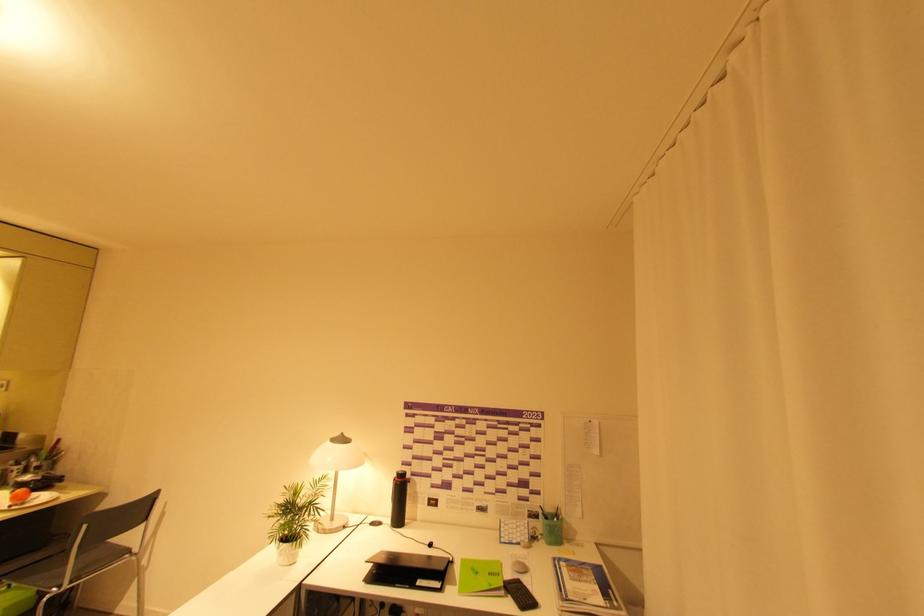
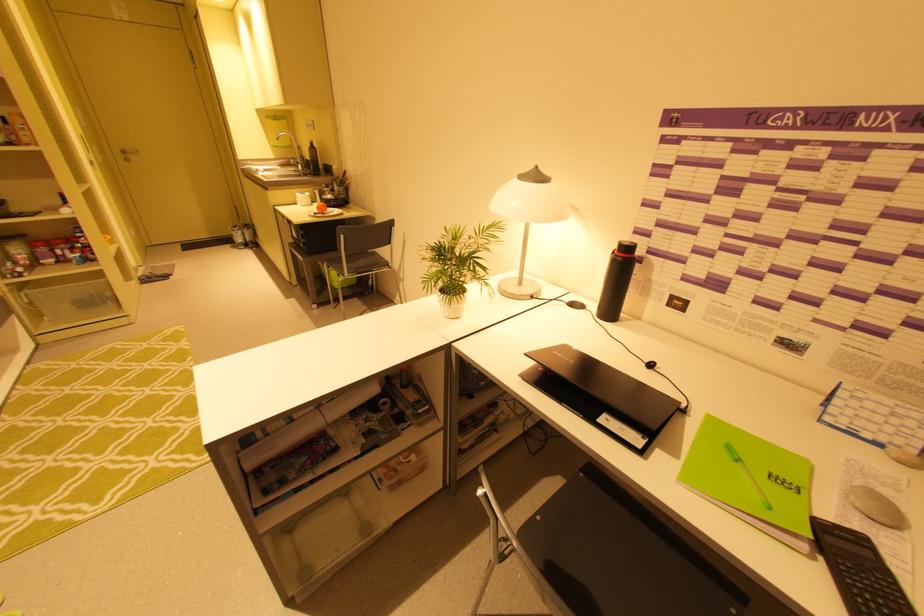
Find the pixel in the second image that matches the point at 399,476 in the first image.

(619, 248)